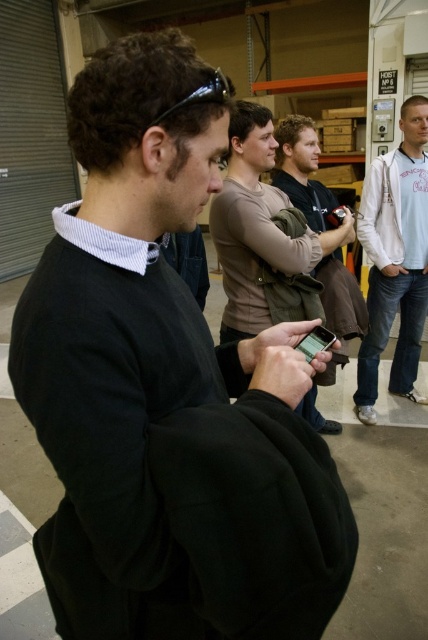
Question: Does white cotton jacket at right appear on the right side of black glossy smartphone at center?

Choices:
 (A) no
 (B) yes

Answer: (B)

Question: Can you confirm if white cotton jacket at right is bigger than black glossy smartphone at center?

Choices:
 (A) no
 (B) yes

Answer: (B)

Question: Observing the image, what is the correct spatial positioning of white cotton jacket at right in reference to brown leather jacket at center?

Choices:
 (A) above
 (B) below

Answer: (A)

Question: Among these objects, which one is nearest to the camera?

Choices:
 (A) black glossy smartphone at center
 (B) white cotton jacket at right
 (C) brown leather jacket at center

Answer: (A)

Question: Which object is positioned closest to the brown leather jacket at center?

Choices:
 (A) white cotton jacket at right
 (B) black glossy smartphone at center

Answer: (A)

Question: Which of these objects is positioned closest to the brown leather jacket at center?

Choices:
 (A) white cotton jacket at right
 (B) black glossy smartphone at center

Answer: (A)